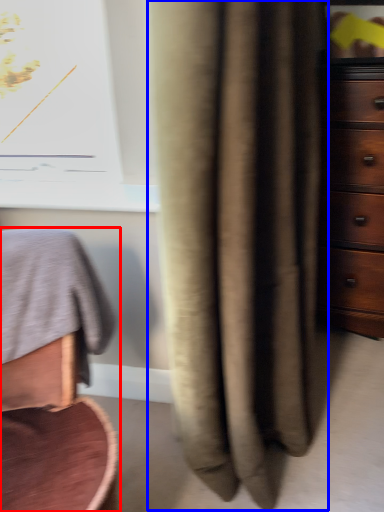
Question: Which point is further to the camera, furniture (highlighted by a red box) or curtain (highlighted by a blue box)?

Choices:
 (A) furniture
 (B) curtain

Answer: (B)